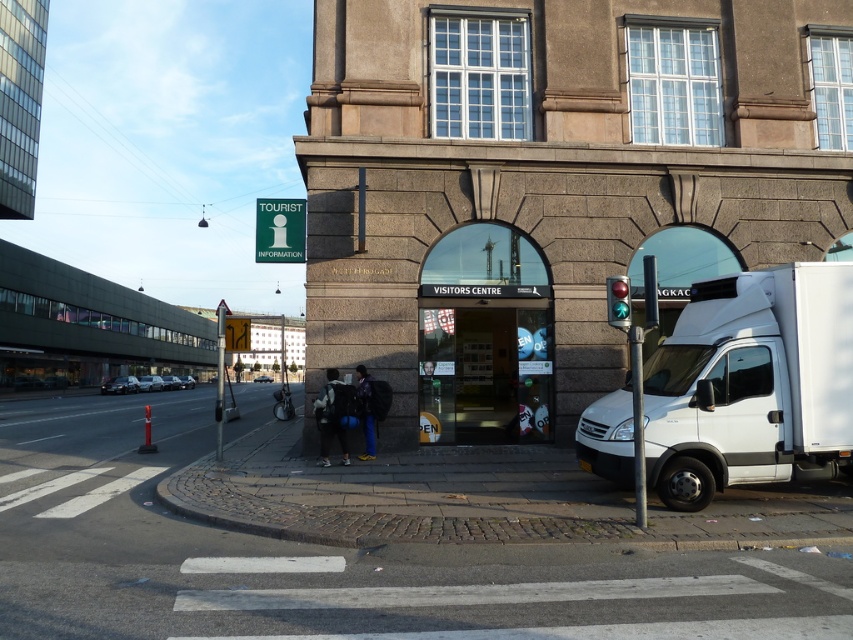
Who is more distant from viewer, (807, 422) or (608, 288)?

The point (807, 422) is more distant.

Find the location of a particular element. This screenshot has width=853, height=640. white matte truck at right is located at coordinates (752, 384).

You are a GUI agent. You are given a task and a screenshot of the screen. Output one action in this format:
    pyautogui.click(x=<x>, y=<y>)
    Task: Click on the white matte truck at right
    The width and height of the screenshot is (853, 640).
    Given the screenshot: What is the action you would take?
    pyautogui.click(x=752, y=384)